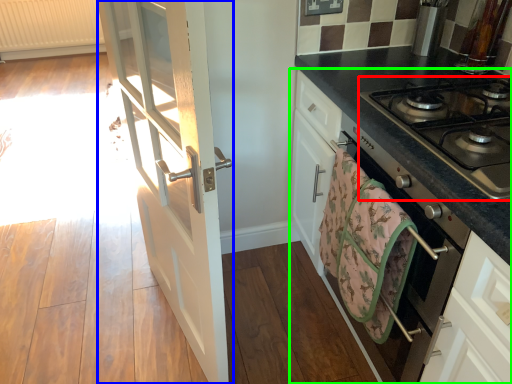
Question: Based on their relative distances, which object is nearer to gas stove (highlighted by a red box)? Choose from door (highlighted by a blue box) and cabinetry (highlighted by a green box).

Choices:
 (A) door
 (B) cabinetry

Answer: (B)